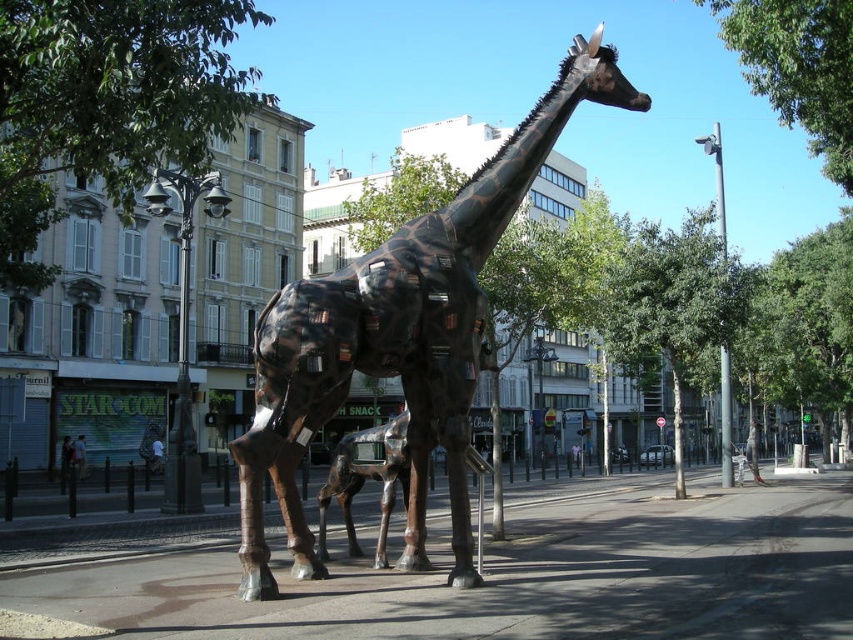
From the picture: You are a delivery person trying to park your 2.5 meter wide delivery van. You see the concrete pavement at center and the green leafy tree at upper center. Which area can accommodate your van?

The concrete pavement at center has a lesser width compared to green leafy tree at upper center, so the green leafy tree at upper center is wider and can accommodate the 2.5 meter wide delivery van.

You are a city planner assessing the urban space. You need to place a new bench between the concrete pavement at center and the green leafy tree at upper center. The bench requires a minimum of 10 meters of space between it and the tree. Is the current distance sufficient for placing the bench?

The distance between the concrete pavement at center and the green leafy tree at upper center is 13.00 meters. Since the bench requires at least 10 meters from the tree, the existing space is sufficient to place the bench.

You are a delivery person who needs to park your bike between the concrete pavement at center and the green leafy tree at center. Where should you place the bike so it doesn

The concrete pavement at center is to the left of the green leafy tree at center, so you should park the bike between them on the left side of the tree or the right side of the pavement.